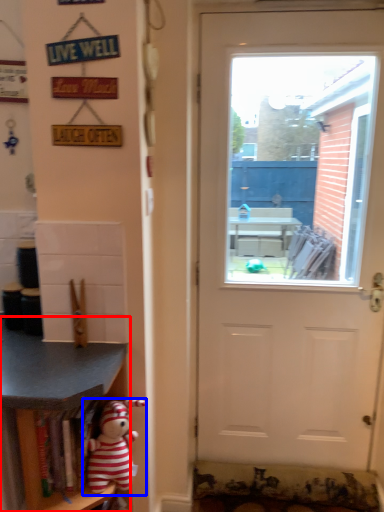
Question: Among these objects, which one is farthest to the camera, shelf (highlighted by a red box) or toy (highlighted by a blue box)?

Choices:
 (A) shelf
 (B) toy

Answer: (B)